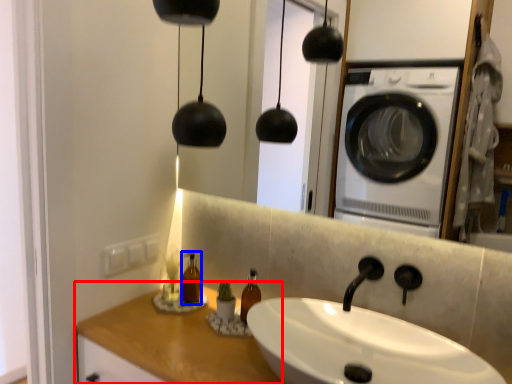
Question: Which object appears closest to the camera in this image, counter top (highlighted by a red box) or bottle (highlighted by a blue box)?

Choices:
 (A) counter top
 (B) bottle

Answer: (A)